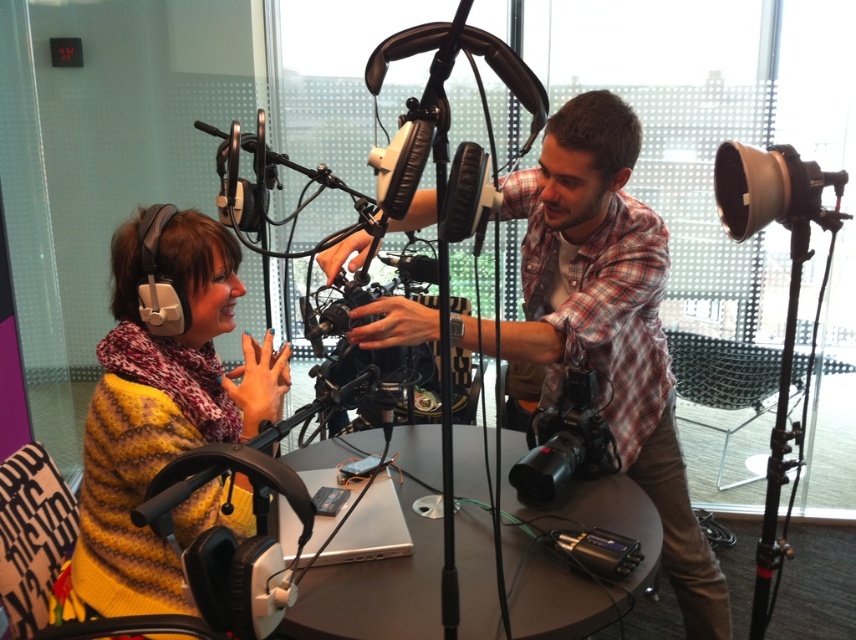
Based on the photo, can you confirm if plaid shirt at center is positioned to the right of black plastic video camera at center?

Indeed, plaid shirt at center is positioned on the right side of black plastic video camera at center.

Who is positioned more to the left, plaid shirt at center or black plastic video camera at center?

black plastic video camera at center is more to the left.

Does point (562, 204) lie in front of point (532, 460)?

Yes, point (562, 204) is closer to viewer.

Where is `plaid shirt at center`? The height and width of the screenshot is (640, 856). plaid shirt at center is located at coordinates (608, 321).

Between metallic silver table at center and black plastic video camera at center, which one appears on the right side from the viewer's perspective?

From the viewer's perspective, black plastic video camera at center appears more on the right side.

Does metallic silver table at center appear on the left side of black plastic video camera at center?

Yes, metallic silver table at center is to the left of black plastic video camera at center.

The width and height of the screenshot is (856, 640). In order to click on metallic silver table at center in this screenshot , I will do `click(565, 563)`.

Is knitted yellow sweater at left closer to camera compared to metallic silver table at center?

Yes, it is in front of metallic silver table at center.

Does knitted yellow sweater at left have a greater width compared to metallic silver table at center?

No, knitted yellow sweater at left is not wider than metallic silver table at center.

In order to click on knitted yellow sweater at left in this screenshot , I will do coord(161,410).

Locate an element on the screen. The image size is (856, 640). knitted yellow sweater at left is located at coordinates click(x=161, y=410).